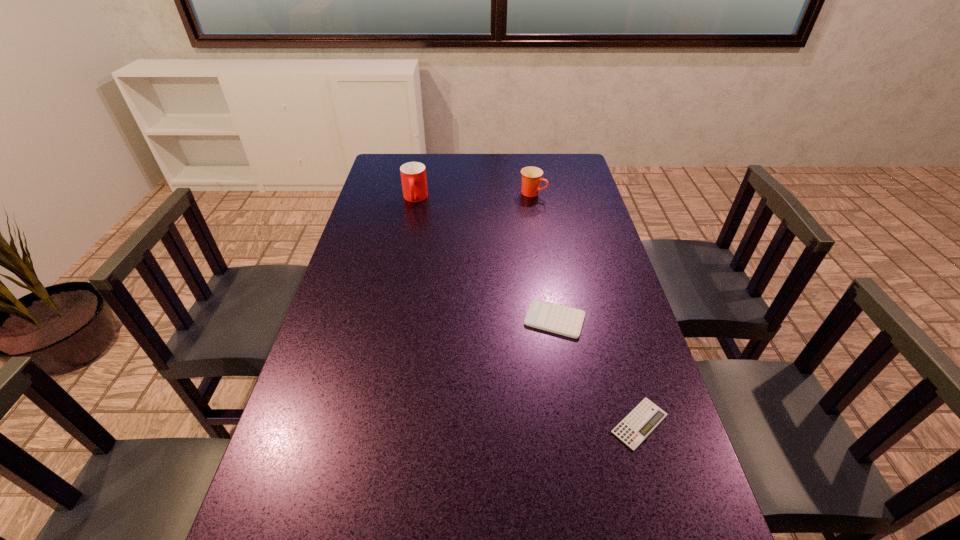
Locate an element on the screen. vacant area in the image that satisfies the following two spatial constraints: 1. on the side of the left cup with the handle; 2. on the right side of the shorter calculator is located at coordinates [x=370, y=423].

Locate an element on the screen. The image size is (960, 540). vacant region that satisfies the following two spatial constraints: 1. on the side of the left cup with the handle; 2. on the right side of the third tallest object is located at coordinates (391, 320).